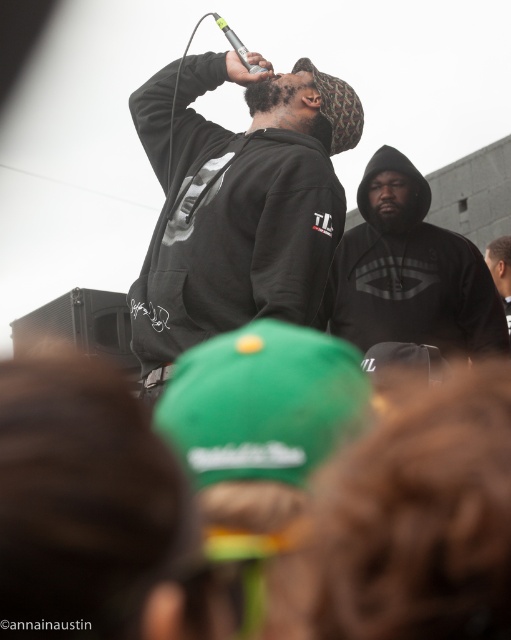
Which is more to the left, matte black hoodie at center or black matte hoodie at center?

matte black hoodie at center

Between matte black hoodie at center and black matte hoodie at center, which one appears on the right side from the viewer's perspective?

black matte hoodie at center is more to the right.

Identify the location of matte black hoodie at center. (238, 204).